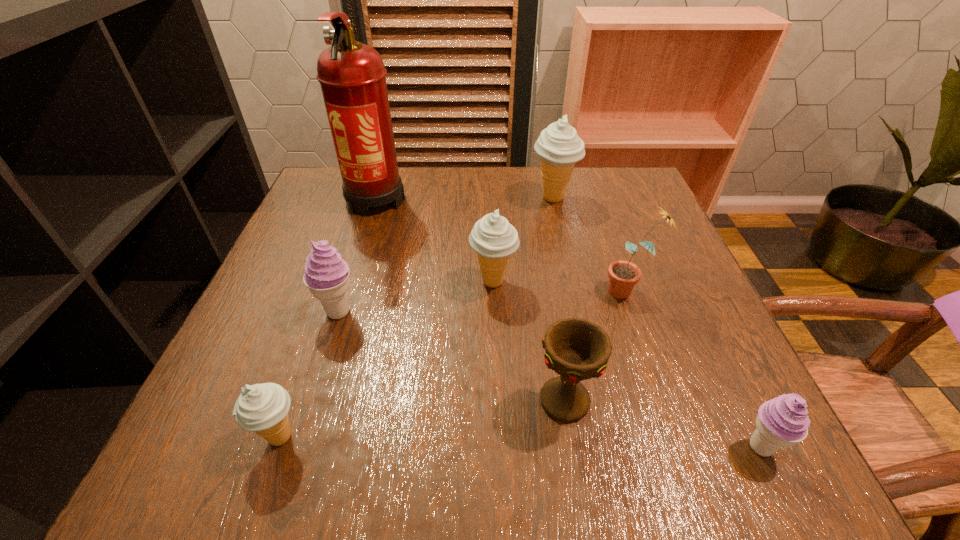
Image resolution: width=960 pixels, height=540 pixels. I want to click on free space that is in between the fifth object from right to left and the chalice, so click(529, 341).

I want to click on vacant point located between the leftmost beige icecream and the rightmost icecream, so click(520, 442).

Find the location of a particular element. The height and width of the screenshot is (540, 960). unoccupied position between the chalice and the second biggest beige icecream is located at coordinates (529, 341).

Find the location of a particular element. Image resolution: width=960 pixels, height=540 pixels. free area in between the smallest beige icecream and the farther purple icecream is located at coordinates (310, 374).

Where is `vacant area that lies between the third icecream from left to right and the nearest beige icecream`? vacant area that lies between the third icecream from left to right and the nearest beige icecream is located at coordinates (387, 359).

Locate an element on the screen. This screenshot has height=540, width=960. vacant space that is in between the fourth object from left to right and the sunflower is located at coordinates (561, 286).

Identify the location of free space between the rightmost icecream and the second farthest beige icecream. (627, 364).

Locate an element on the screen. vacant space that's between the rightmost object and the second beige icecream from left to right is located at coordinates (627, 364).

Locate an element on the screen. The width and height of the screenshot is (960, 540). free space between the leftmost beige icecream and the red chalice is located at coordinates (422, 418).

Where is `empty location between the smallest beige icecream and the second biggest beige icecream`? The width and height of the screenshot is (960, 540). empty location between the smallest beige icecream and the second biggest beige icecream is located at coordinates (387, 359).